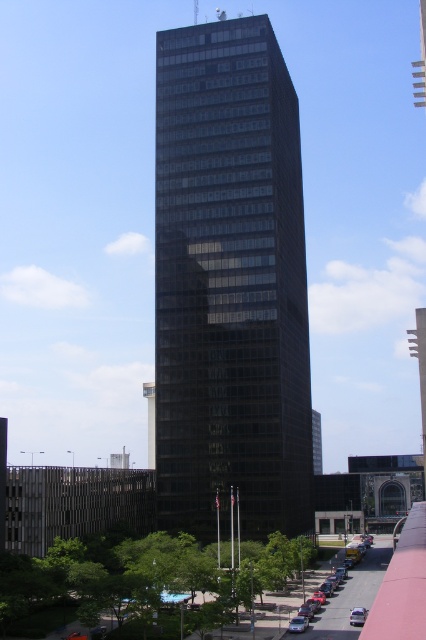
Question: Can you confirm if silver metallic sedan at lower right is positioned below silver metallic sedan at center?

Choices:
 (A) no
 (B) yes

Answer: (B)

Question: Is metallic silver sedan at lower right below silver metallic sedan at center?

Choices:
 (A) no
 (B) yes

Answer: (B)

Question: Is black glass building at center positioned in front of metallic silver sedan at lower right?

Choices:
 (A) yes
 (B) no

Answer: (B)

Question: Which of the following is the farthest from the observer?

Choices:
 (A) metallic silver sedan at lower right
 (B) silver metallic sedan at center
 (C) silver metallic sedan at lower right
 (D) black glass building at center

Answer: (D)

Question: Which point is farther to the camera?

Choices:
 (A) silver metallic sedan at center
 (B) black glass building at center

Answer: (B)

Question: Which of these objects is positioned closest to the metallic silver sedan at lower right?

Choices:
 (A) silver metallic sedan at center
 (B) black glass building at center
 (C) silver metallic sedan at lower right

Answer: (C)